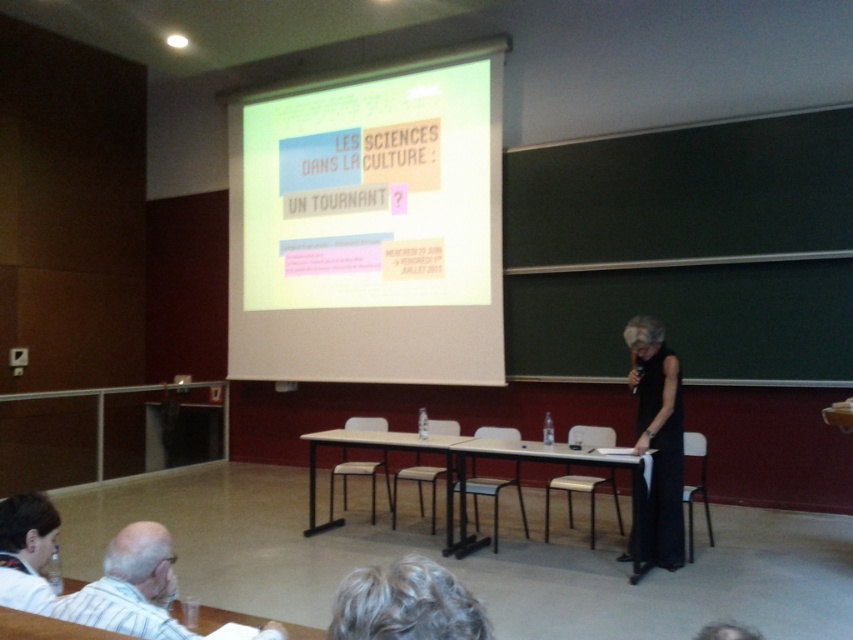
You are standing in the lecture hall and want to move to the point at coordinates (497, 454). If you are 4.69 meters away from it, is it possible to reach there without any obstacles?

The point at coordinates (497, 454) is 4.69 meters away from you. Since there are no obstacles mentioned in the scene description, it is possible to reach there without any issues.

You are organizing a small event and need to place a 15 inch wide laptop between the light brown wooden table at center and the light brown wood table at center. Will there be enough space for the laptop to fit between them?

The light brown wooden table at center and the light brown wood table at center are 17.06 inches apart, so yes, the 15 inch wide laptop will fit between them since the space is wider than the laptop.